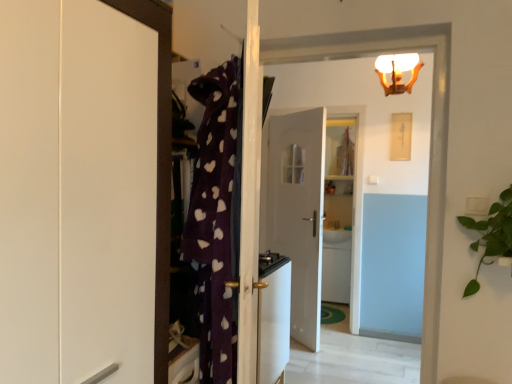
Question: Considering the relative sizes of white frosted glass light fixture at upper center and white glossy door at center, acting as the second door starting from the front, in the image provided, is white frosted glass light fixture at upper center taller than white glossy door at center, acting as the second door starting from the front,?

Choices:
 (A) yes
 (B) no

Answer: (B)

Question: Can you confirm if white frosted glass light fixture at upper center is smaller than white glossy door at center, acting as the second door starting from the front?

Choices:
 (A) yes
 (B) no

Answer: (A)

Question: Is white frosted glass light fixture at upper center at the left side of white glossy door at center, acting as the second door starting from the front?

Choices:
 (A) no
 (B) yes

Answer: (A)

Question: Considering the relative sizes of white frosted glass light fixture at upper center and white glossy door at center, arranged as the 1th door when viewed from the back, in the image provided, is white frosted glass light fixture at upper center wider than white glossy door at center, arranged as the 1th door when viewed from the back,?

Choices:
 (A) yes
 (B) no

Answer: (A)

Question: Considering the relative sizes of white frosted glass light fixture at upper center and white glossy door at center, arranged as the 1th door when viewed from the back, in the image provided, is white frosted glass light fixture at upper center bigger than white glossy door at center, arranged as the 1th door when viewed from the back,?

Choices:
 (A) no
 (B) yes

Answer: (A)

Question: From a real-world perspective, does white frosted glass light fixture at upper center sit lower than white glossy door at center, acting as the second door starting from the front?

Choices:
 (A) yes
 (B) no

Answer: (B)

Question: Considering the relative positions of white glossy stove at center and green leafy plant at right in the image provided, is white glossy stove at center in front of green leafy plant at right?

Choices:
 (A) no
 (B) yes

Answer: (A)

Question: Is white glossy stove at center completely or partially outside of green leafy plant at right?

Choices:
 (A) yes
 (B) no

Answer: (A)

Question: Can you confirm if white glossy stove at center is positioned to the right of green leafy plant at right?

Choices:
 (A) yes
 (B) no

Answer: (B)

Question: Is white glossy stove at center aimed at green leafy plant at right?

Choices:
 (A) no
 (B) yes

Answer: (A)

Question: Does white glossy stove at center have a greater width compared to green leafy plant at right?

Choices:
 (A) yes
 (B) no

Answer: (B)

Question: Does white glossy stove at center appear on the left side of green leafy plant at right?

Choices:
 (A) yes
 (B) no

Answer: (A)

Question: Can you confirm if white glossy sink at center is positioned to the left of white glossy door at upper center, which ranks as the 2th door in back-to-front order?

Choices:
 (A) yes
 (B) no

Answer: (B)